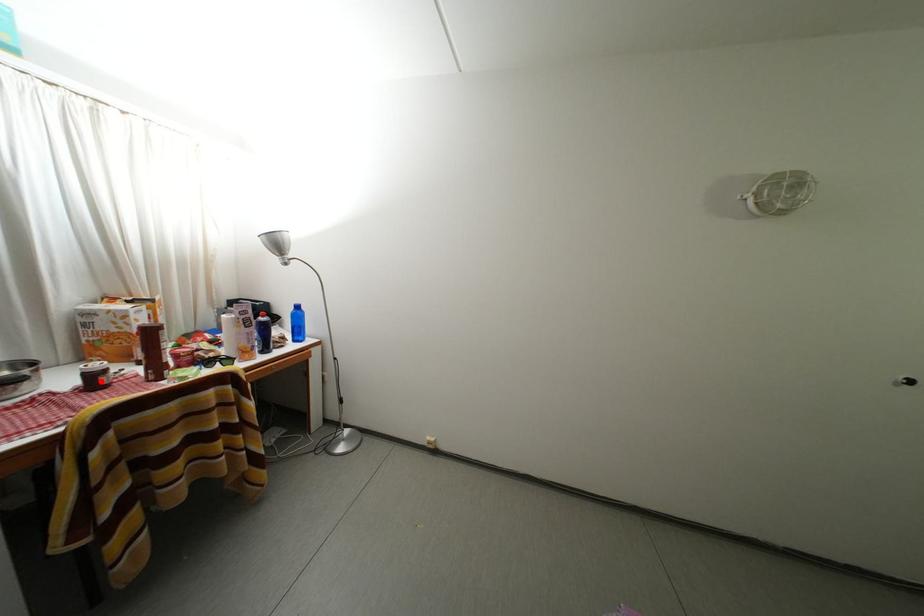
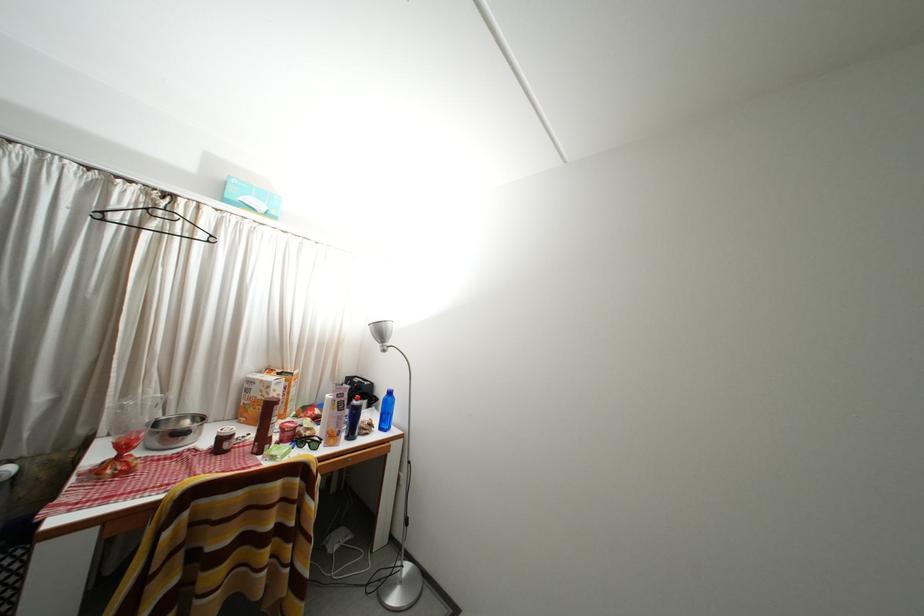
Find the pixel in the second image that matches the highlighted location in the first image.

(229, 445)